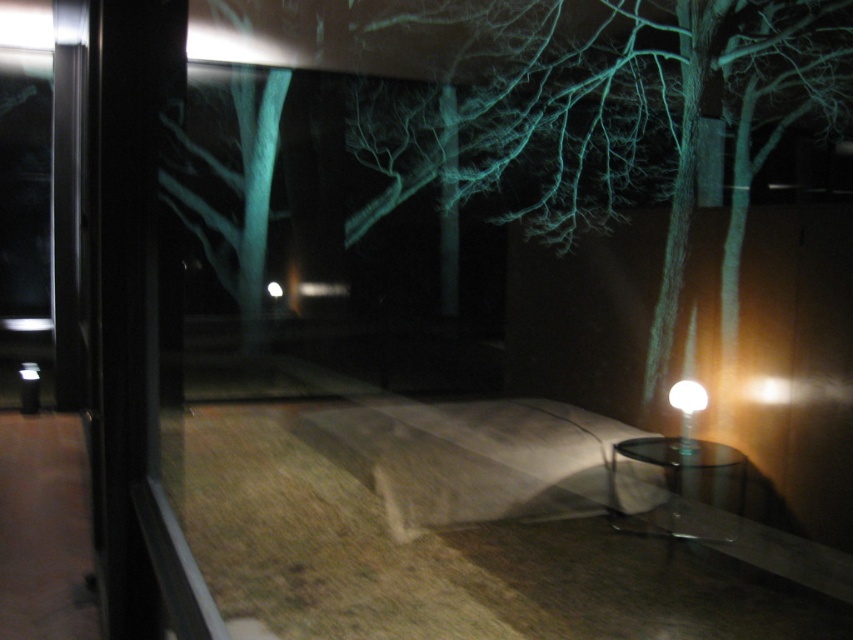
Question: Is white fabric bed at lower center wider than white glossy lamp at right?

Choices:
 (A) no
 (B) yes

Answer: (B)

Question: Can you confirm if white glossy lamp at right is positioned to the left of white glossy light at lower right?

Choices:
 (A) yes
 (B) no

Answer: (A)

Question: From the image, what is the correct spatial relationship of white fabric bed at lower center in relation to white glossy light at lower right?

Choices:
 (A) below
 (B) above

Answer: (A)

Question: Considering the real-world distances, which object is farthest from the white fabric bed at lower center?

Choices:
 (A) green translucent tree at upper center
 (B) white glossy lamp at right
 (C) white glossy light at lower right

Answer: (A)

Question: Which object is closer to the camera taking this photo?

Choices:
 (A) white fabric bed at lower center
 (B) white glossy lamp at right
 (C) white glossy light at lower right
 (D) green translucent tree at upper center

Answer: (A)

Question: Which of the following is the closest to the observer?

Choices:
 (A) green translucent tree at upper center
 (B) white glossy light at lower right
 (C) white glossy lamp at right
 (D) white fabric bed at lower center

Answer: (D)